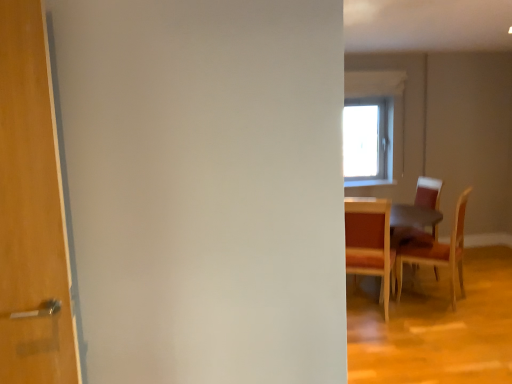
Question: In the image, is wooden chair at right, acting as the 2th chair starting from the right, on the left side or the right side of wooden chair at right, the 1th chair positioned from the right?

Choices:
 (A) left
 (B) right

Answer: (A)

Question: Looking at the image, does wooden chair at right, acting as the 2th chair starting from the right, seem bigger or smaller compared to wooden chair at right, the 1th chair positioned from the right?

Choices:
 (A) small
 (B) big

Answer: (A)

Question: Estimate the real-world distances between objects in this image. Which object is closer to the wooden chair at right, which is the 3th chair from left to right?

Choices:
 (A) wooden chair at right, which is counted as the 3th chair, starting from the right
 (B) wooden table at right
 (C) wooden chair at right, acting as the 2th chair starting from the right

Answer: (C)

Question: Based on their relative distances, which object is farther from the wooden chair at right, which is the 3th chair from left to right?

Choices:
 (A) wooden chair at right, the second chair viewed from the left
 (B) wooden table at right
 (C) wooden chair at right, the 1th chair in the left-to-right sequence

Answer: (C)